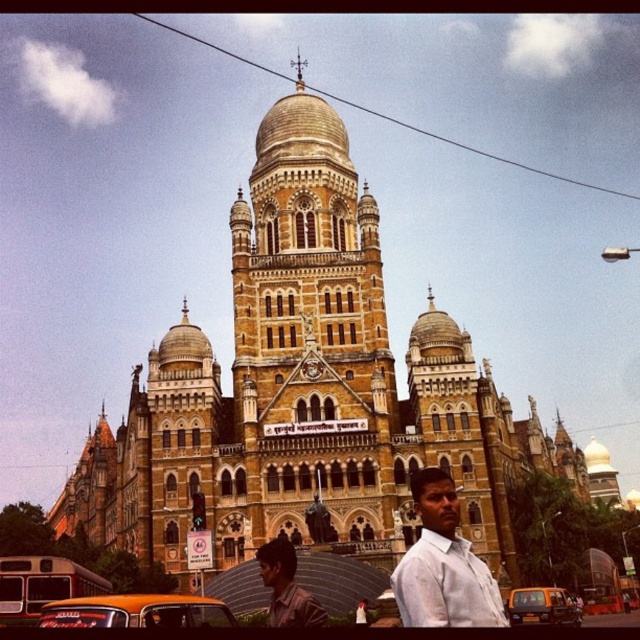
Question: Can you confirm if white cotton shirt at center is smaller than orange matte taxi at lower center?

Choices:
 (A) yes
 (B) no

Answer: (B)

Question: Is the position of white cotton shirt at center more distant than that of yellow matte taxi at lower left?

Choices:
 (A) no
 (B) yes

Answer: (A)

Question: Which point appears closest to the camera in this image?

Choices:
 (A) (48, 620)
 (B) (301, 68)
 (C) (417, 609)
 (D) (564, 605)

Answer: (C)

Question: Among these objects, which one is farthest from the camera?

Choices:
 (A) white cotton shirt at center
 (B) dark brown shirt at center

Answer: (B)

Question: Is dark brown shirt at center positioned at the back of polished brass spire at center top?

Choices:
 (A) no
 (B) yes

Answer: (A)

Question: Which point appears farthest from the camera in this image?

Choices:
 (A) (291, 61)
 (B) (522, 620)
 (C) (484, 625)
 (D) (195, 595)

Answer: (A)